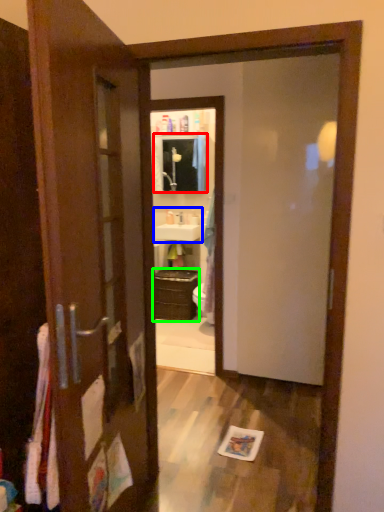
Question: Which object is the closest to the medicine cabinet (highlighted by a red box)? Choose among these: sink (highlighted by a blue box) or cabinetry (highlighted by a green box).

Choices:
 (A) sink
 (B) cabinetry

Answer: (A)